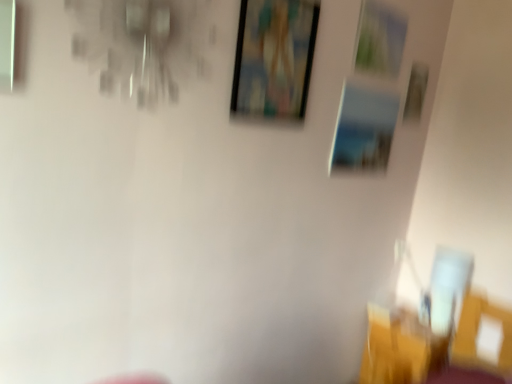
Measure the distance between point (254, 113) and camera.

5.48 feet.

Image resolution: width=512 pixels, height=384 pixels. What do you see at coordinates (395, 348) in the screenshot? I see `yellow fabric chair at lower right` at bounding box center [395, 348].

This screenshot has height=384, width=512. I want to click on metallic silver picture frame at upper center, which is the second picture frame from left to right, so click(364, 129).

Can you see wooden picture frame at upper right, the 1th picture frame positioned from the right, touching metallic silver picture frame at upper right, the third picture frame in the left-to-right sequence?

No, wooden picture frame at upper right, the 1th picture frame positioned from the right, is not next to metallic silver picture frame at upper right, the third picture frame in the left-to-right sequence.

Between wooden picture frame at upper right, which is counted as the fourth picture frame, starting from the left, and metallic silver picture frame at upper right, the second picture frame viewed from the right, which one has less height?

metallic silver picture frame at upper right, the second picture frame viewed from the right, is shorter.

Is wooden picture frame at upper right, which is counted as the fourth picture frame, starting from the left, wider than metallic silver picture frame at upper right, the second picture frame viewed from the right?

Yes.

Which object is closer to the camera taking this photo, metallic silver picture frame at upper right, the third picture frame in the left-to-right sequence, or wooden picture frame at upper center, which is the first picture frame in left-to-right order?

Positioned in front is wooden picture frame at upper center, which is the first picture frame in left-to-right order.

Considering the relative sizes of metallic silver picture frame at upper right, the third picture frame in the left-to-right sequence, and wooden picture frame at upper center, which is the first picture frame in left-to-right order, in the image provided, is metallic silver picture frame at upper right, the third picture frame in the left-to-right sequence, wider than wooden picture frame at upper center, which is the first picture frame in left-to-right order,?

No.

Which is farther from the camera, (362, 1) or (250, 82)?

The point (362, 1) is behind.

Is metallic silver picture frame at upper right, the third picture frame in the left-to-right sequence, taller or shorter than wooden picture frame at upper center, the 4th picture frame from the right?

Clearly, metallic silver picture frame at upper right, the third picture frame in the left-to-right sequence, is shorter compared to wooden picture frame at upper center, the 4th picture frame from the right.

Can you confirm if wooden picture frame at upper right, the 1th picture frame positioned from the right, is taller than yellow fabric chair at lower right?

No.

Is wooden picture frame at upper right, which is counted as the fourth picture frame, starting from the left, positioned behind yellow fabric chair at lower right?

Yes, wooden picture frame at upper right, which is counted as the fourth picture frame, starting from the left, is behind yellow fabric chair at lower right.

Is wooden picture frame at upper right, the 1th picture frame positioned from the right, wider or thinner than yellow fabric chair at lower right?

wooden picture frame at upper right, the 1th picture frame positioned from the right, is thinner than yellow fabric chair at lower right.

Which is more to the right, wooden picture frame at upper right, the 1th picture frame positioned from the right, or yellow fabric chair at lower right?

wooden picture frame at upper right, the 1th picture frame positioned from the right.

Are wooden picture frame at upper right, which is counted as the fourth picture frame, starting from the left, and wooden picture frame at upper center, the 4th picture frame from the right, beside each other?

wooden picture frame at upper right, which is counted as the fourth picture frame, starting from the left, is not next to wooden picture frame at upper center, the 4th picture frame from the right, and they're not touching.

Which of these two, wooden picture frame at upper right, the 1th picture frame positioned from the right, or wooden picture frame at upper center, which is the first picture frame in left-to-right order, stands taller?

wooden picture frame at upper center, which is the first picture frame in left-to-right order, is taller.

Is wooden picture frame at upper right, which is counted as the fourth picture frame, starting from the left, in front of or behind wooden picture frame at upper center, the 4th picture frame from the right, in the image?

wooden picture frame at upper right, which is counted as the fourth picture frame, starting from the left, is positioned farther from the viewer than wooden picture frame at upper center, the 4th picture frame from the right.

From the image's perspective, would you say wooden picture frame at upper right, the 1th picture frame positioned from the right, is positioned over wooden picture frame at upper center, the 4th picture frame from the right?

Yes, from the image's perspective, wooden picture frame at upper right, the 1th picture frame positioned from the right, is on top of wooden picture frame at upper center, the 4th picture frame from the right.

Which of these two, metallic silver picture frame at upper center, which is the second picture frame from left to right, or metallic silver picture frame at upper right, the second picture frame viewed from the right, stands shorter?

metallic silver picture frame at upper right, the second picture frame viewed from the right.

Considering the positions of points (370, 114) and (397, 40), is point (370, 114) farther from camera compared to point (397, 40)?

No, (370, 114) is closer to viewer.

Consider the image. Are metallic silver picture frame at upper center, which appears as the 3th picture frame when viewed from the right, and metallic silver picture frame at upper right, the second picture frame viewed from the right, making contact?

No, metallic silver picture frame at upper center, which appears as the 3th picture frame when viewed from the right, is not with metallic silver picture frame at upper right, the second picture frame viewed from the right.

From a real-world perspective, is yellow fabric chair at lower right located beneath metallic silver picture frame at upper center, which is the second picture frame from left to right?

Yes, from a real-world perspective, yellow fabric chair at lower right is under metallic silver picture frame at upper center, which is the second picture frame from left to right.

Is yellow fabric chair at lower right positioned with its back to metallic silver picture frame at upper center, which appears as the 3th picture frame when viewed from the right?

No.

Based on their sizes in the image, would you say yellow fabric chair at lower right is bigger or smaller than metallic silver picture frame at upper center, which is the second picture frame from left to right?

yellow fabric chair at lower right is bigger than metallic silver picture frame at upper center, which is the second picture frame from left to right.

Can you tell me how much yellow fabric chair at lower right and metallic silver picture frame at upper center, which is the second picture frame from left to right, differ in facing direction?

yellow fabric chair at lower right and metallic silver picture frame at upper center, which is the second picture frame from left to right, are facing 89.9 degrees away from each other.

Would you say metallic silver picture frame at upper right, the second picture frame viewed from the right, contains wooden picture frame at upper right, the 1th picture frame positioned from the right?

No, wooden picture frame at upper right, the 1th picture frame positioned from the right, is not inside metallic silver picture frame at upper right, the second picture frame viewed from the right.

How different are the orientations of metallic silver picture frame at upper right, the second picture frame viewed from the right, and wooden picture frame at upper right, which is counted as the fourth picture frame, starting from the left, in degrees?

The facing directions of metallic silver picture frame at upper right, the second picture frame viewed from the right, and wooden picture frame at upper right, which is counted as the fourth picture frame, starting from the left, are 0.606 degrees apart.

Looking at this image, from the image's perspective, is metallic silver picture frame at upper right, the second picture frame viewed from the right, positioned above or below wooden picture frame at upper right, the 1th picture frame positioned from the right?

metallic silver picture frame at upper right, the second picture frame viewed from the right, is situated higher than wooden picture frame at upper right, the 1th picture frame positioned from the right, in the image.

Locate an element on the screen. picture frame on the right of metallic silver picture frame at upper right, the third picture frame in the left-to-right sequence is located at coordinates (416, 92).

This screenshot has width=512, height=384. I want to click on picture frame that is on the right side of metallic silver picture frame at upper right, the third picture frame in the left-to-right sequence, so click(x=416, y=92).

This screenshot has width=512, height=384. Find the location of `picture frame that is the 1st one when counting backward from the wooden picture frame at upper center, the 4th picture frame from the right`. picture frame that is the 1st one when counting backward from the wooden picture frame at upper center, the 4th picture frame from the right is located at coordinates (379, 40).

Considering their positions, is wooden picture frame at upper center, which is the first picture frame in left-to-right order, positioned further to wooden picture frame at upper right, the 1th picture frame positioned from the right, than metallic silver picture frame at upper right, the second picture frame viewed from the right?

wooden picture frame at upper center, which is the first picture frame in left-to-right order.

From the image, which object appears to be farther from wooden picture frame at upper right, the 1th picture frame positioned from the right, metallic silver picture frame at upper center, which is the second picture frame from left to right, or metallic silver picture frame at upper right, the second picture frame viewed from the right?

Based on the image, metallic silver picture frame at upper center, which is the second picture frame from left to right, appears to be further to wooden picture frame at upper right, the 1th picture frame positioned from the right.

From the image, which object appears to be farther from metallic silver picture frame at upper center, which is the second picture frame from left to right, metallic silver picture frame at upper right, the third picture frame in the left-to-right sequence, or wooden picture frame at upper center, the 4th picture frame from the right?

Among the two, wooden picture frame at upper center, the 4th picture frame from the right, is located further to metallic silver picture frame at upper center, which is the second picture frame from left to right.

Consider the image. From the image, which object appears to be nearer to wooden picture frame at upper right, which is counted as the fourth picture frame, starting from the left, metallic silver picture frame at upper right, the second picture frame viewed from the right, or metallic silver picture frame at upper center, which is the second picture frame from left to right?

metallic silver picture frame at upper right, the second picture frame viewed from the right, is positioned closer to the anchor wooden picture frame at upper right, which is counted as the fourth picture frame, starting from the left.

Considering their positions, is wooden picture frame at upper right, the 1th picture frame positioned from the right, positioned closer to yellow fabric chair at lower right than wooden picture frame at upper center, the 4th picture frame from the right?

Based on the image, wooden picture frame at upper right, the 1th picture frame positioned from the right, appears to be nearer to yellow fabric chair at lower right.

Which object lies nearer to the anchor point metallic silver picture frame at upper right, the second picture frame viewed from the right, wooden picture frame at upper right, the 1th picture frame positioned from the right, or metallic silver picture frame at upper center, which appears as the 3th picture frame when viewed from the right?

Based on the image, metallic silver picture frame at upper center, which appears as the 3th picture frame when viewed from the right, appears to be nearer to metallic silver picture frame at upper right, the second picture frame viewed from the right.

From the image, which object appears to be farther from wooden picture frame at upper center, which is the first picture frame in left-to-right order, wooden picture frame at upper right, the 1th picture frame positioned from the right, or metallic silver picture frame at upper right, the third picture frame in the left-to-right sequence?

wooden picture frame at upper right, the 1th picture frame positioned from the right.

From the image, which object appears to be farther from metallic silver picture frame at upper right, the third picture frame in the left-to-right sequence, metallic silver picture frame at upper center, which is the second picture frame from left to right, or yellow fabric chair at lower right?

Among the two, yellow fabric chair at lower right is located further to metallic silver picture frame at upper right, the third picture frame in the left-to-right sequence.

Locate an element on the screen. The width and height of the screenshot is (512, 384). picture frame between wooden picture frame at upper center, the 4th picture frame from the right, and metallic silver picture frame at upper right, the third picture frame in the left-to-right sequence, from left to right is located at coordinates (364, 129).

Identify the location of picture frame between metallic silver picture frame at upper right, the second picture frame viewed from the right, and wooden picture frame at upper right, which is counted as the fourth picture frame, starting from the left, in the front-back direction. (364, 129).

You are a GUI agent. You are given a task and a screenshot of the screen. Output one action in this format:
    pyautogui.click(x=<x>, y=<y>)
    Task: Click on the picture frame that lies between wooden picture frame at upper center, which is the first picture frame in left-to-right order, and yellow fabric chair at lower right from top to bottom
    The width and height of the screenshot is (512, 384).
    Given the screenshot: What is the action you would take?
    pyautogui.click(x=364, y=129)